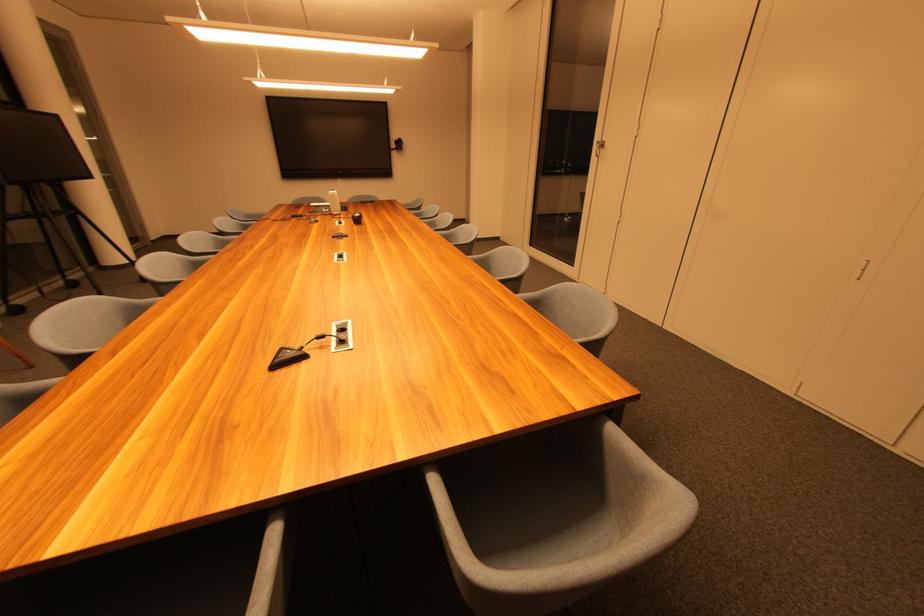
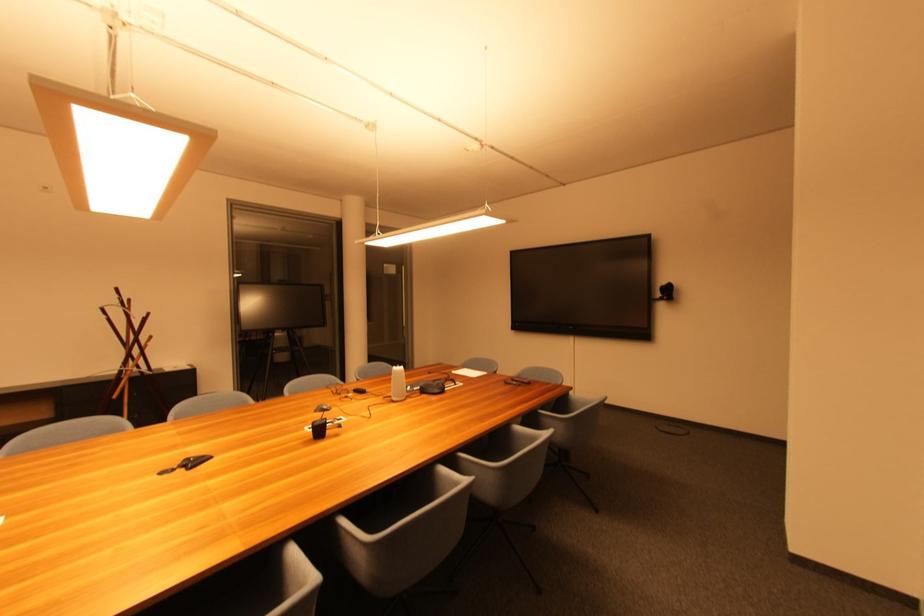
In the second image, find the point that corresponds to the point at 405,146 in the first image.

(673, 292)